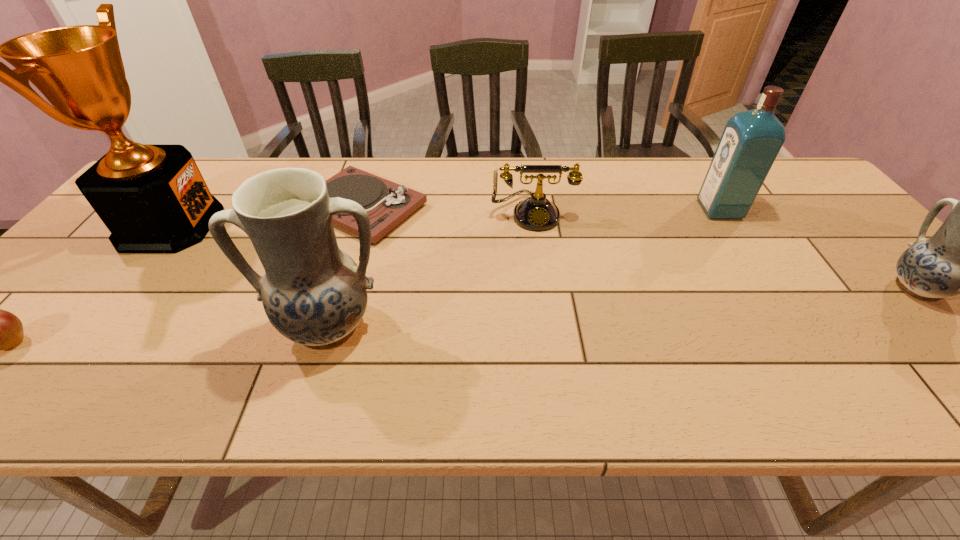
Find the location of a particular element. This screenshot has width=960, height=540. the left pottery is located at coordinates (313, 293).

Identify the location of liquor. Image resolution: width=960 pixels, height=540 pixels. click(x=751, y=140).

Find the location of a particular element. The image size is (960, 540). trophy cup is located at coordinates (152, 198).

Identify the location of the shortest object. (387, 204).

The height and width of the screenshot is (540, 960). I want to click on the fifth object from left to right, so click(x=537, y=213).

The width and height of the screenshot is (960, 540). What are the coordinates of `the fifth tallest object` in the screenshot? It's located at (537, 213).

Find the location of a particular element. The height and width of the screenshot is (540, 960). vacant space located 0.330m on the left of the taller pottery is located at coordinates (114, 326).

Where is `free space located on the flat label side of the second object from right to left`? The width and height of the screenshot is (960, 540). free space located on the flat label side of the second object from right to left is located at coordinates (564, 210).

Find the location of a particular element. This screenshot has height=540, width=960. vacant region located 0.310m on the flat label side of the second object from right to left is located at coordinates (592, 210).

Find the location of a particular element. blank space located on the flat label side of the second object from right to left is located at coordinates tap(610, 210).